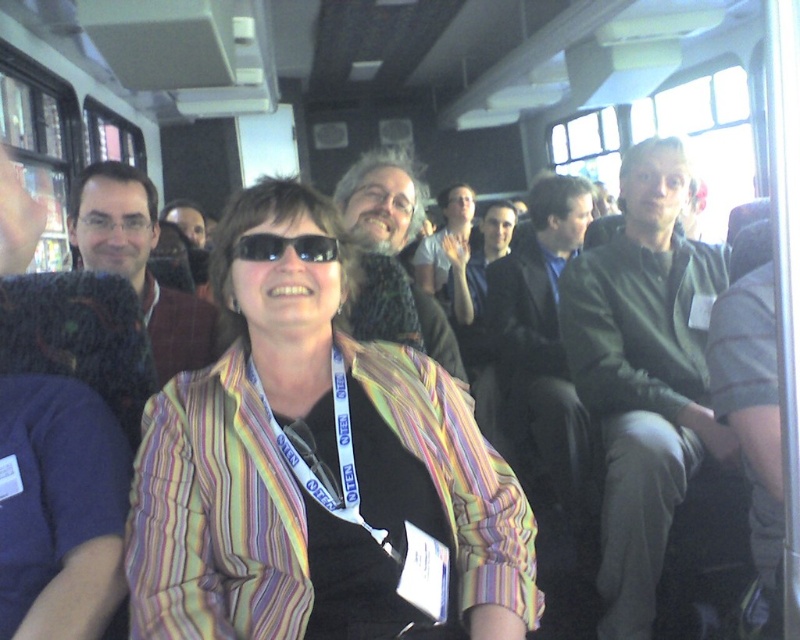
Image resolution: width=800 pixels, height=640 pixels. What do you see at coordinates (644, 374) in the screenshot?
I see `green cotton shirt at right` at bounding box center [644, 374].

Which of these two, green cotton shirt at right or matte brown sweater at left, stands shorter?

matte brown sweater at left

The width and height of the screenshot is (800, 640). What are the coordinates of `green cotton shirt at right` in the screenshot? It's located at (644, 374).

Find the location of a particular element. green cotton shirt at right is located at coordinates (644, 374).

Can you confirm if matte black camera at center is wider than black plastic sunglasses at center?

Yes.

Can you confirm if matte black camera at center is positioned to the left of black plastic sunglasses at center?

Incorrect, matte black camera at center is not on the left side of black plastic sunglasses at center.

Describe the element at coordinates (380, 200) in the screenshot. This screenshot has width=800, height=640. I see `matte black camera at center` at that location.

The image size is (800, 640). In order to click on matte black camera at center in this screenshot , I will do `click(380, 200)`.

Based on the photo, between striped fabric jacket at center and matte black hair at center, which one has more height?

Standing taller between the two is striped fabric jacket at center.

Who is more distant from viewer, [464,563] or [176,224]?

Point [176,224]

Identify the location of striped fabric jacket at center. (312, 467).